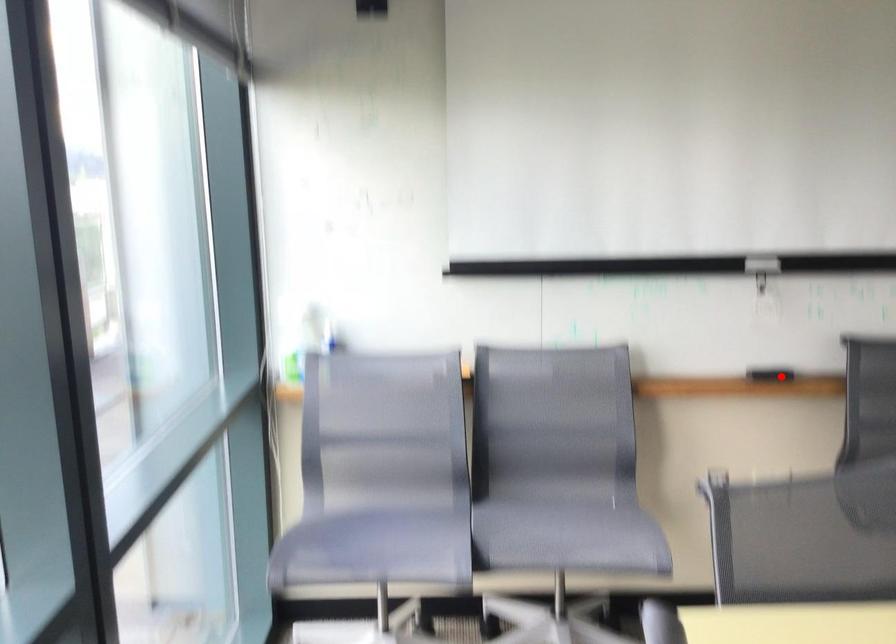
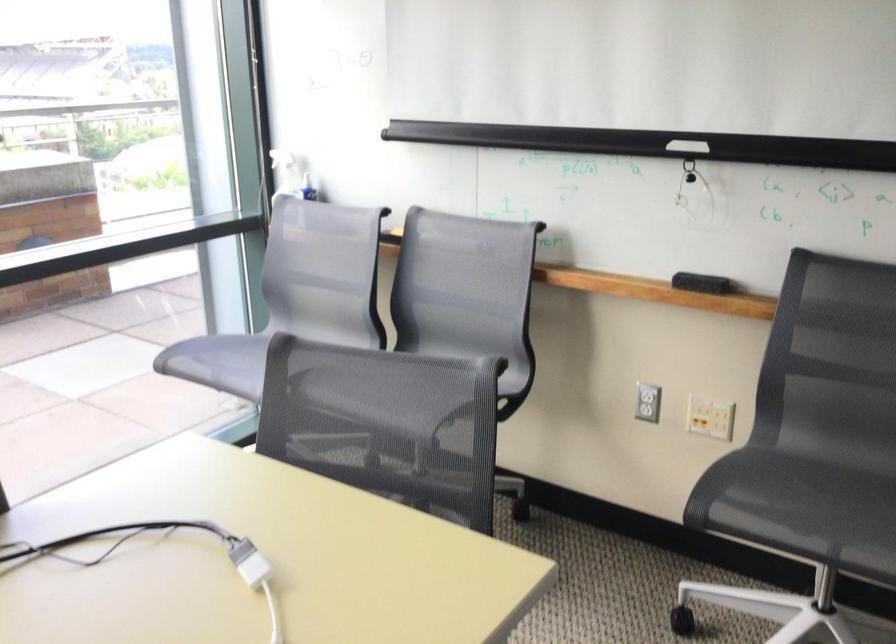
Question: I am providing you with two images of the same scene from different viewpoints. A red point is shown in image1. For the corresponding object point in image2, is it positioned nearer or farther from the camera?

Choices:
 (A) Nearer
 (B) Farther

Answer: (A)